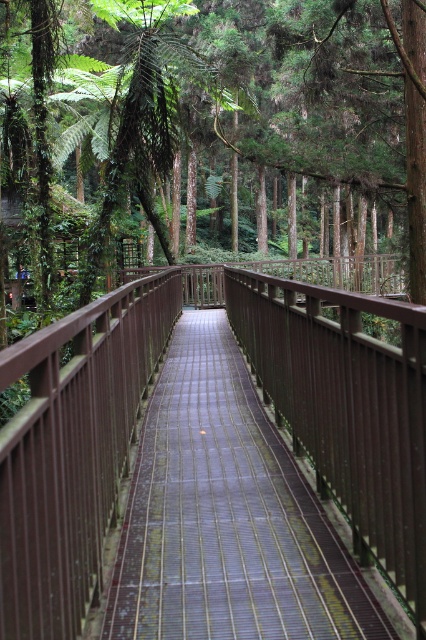
Which is above, green leafy forest at center or brown wooden rail at center?

green leafy forest at center is higher up.

Is green leafy forest at center positioned before brown wooden rail at center?

No, it is behind brown wooden rail at center.

In the scene shown: Who is more distant from viewer, (270, 163) or (308, 353)?

Positioned behind is point (270, 163).

At what (x,y) coordinates should I click in order to perform the action: click on green leafy forest at center. Please return your answer as a coordinate pair (x, y). The image size is (426, 640). Looking at the image, I should click on (224, 128).

Who is higher up, green leafy forest at center or brown wooden bridge at center?

green leafy forest at center

Which is below, green leafy forest at center or brown wooden bridge at center?

brown wooden bridge at center is below.

Which is behind, point (409, 221) or point (235, 372)?

The point (409, 221) is more distant.

At what (x,y) coordinates should I click in order to perform the action: click on green leafy forest at center. Please return your answer as a coordinate pair (x, y). Looking at the image, I should click on (224, 128).

Is point (273, 577) more distant than point (313, 381)?

That is False.

Is brown wooden bridge at center taller than brown wooden rail at center?

No, brown wooden bridge at center is not taller than brown wooden rail at center.

Is point (207, 433) closer to viewer compared to point (333, 458)?

No.

What are the coordinates of `brown wooden bridge at center` in the screenshot? It's located at (227, 515).